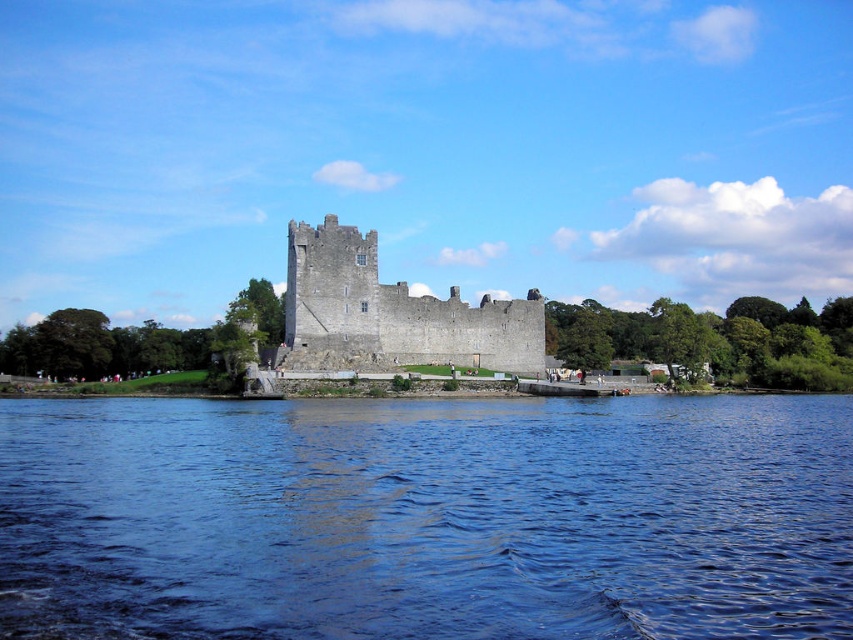
You are standing at the edge of the blue water at lower center and want to reach the gray stone castle at center. Which direction should you move to get closer to the castle?

You should move towards the gray stone castle at center, which is located in the central area of the scene, while the blue water at lower center is positioned at the lower part. Moving upwards or towards the center would bring you closer to the castle.